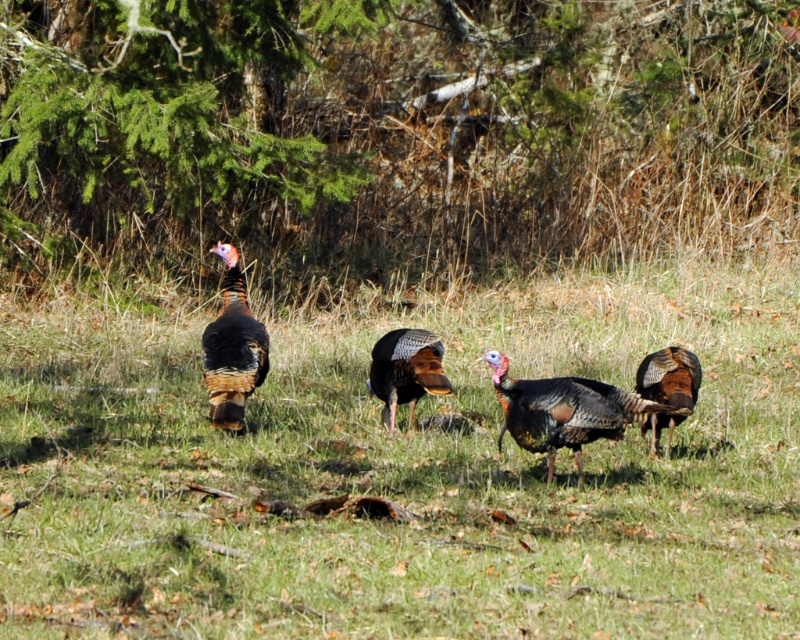
Between glossy iridescent turkey at center and shiny metallic turkey at center, which one has more height?

With more height is glossy iridescent turkey at center.

Is point (574, 401) positioned before point (388, 356)?

Yes, it is.

This screenshot has width=800, height=640. Identify the location of glossy iridescent turkey at center. (554, 412).

Is glossy iridescent turkey at center smaller than multicolored feathered turkey at center?

Incorrect, glossy iridescent turkey at center is not smaller in size than multicolored feathered turkey at center.

Between point (526, 417) and point (214, 380), which one is positioned in front?

Point (526, 417) is in front.

The width and height of the screenshot is (800, 640). In order to click on glossy iridescent turkey at center in this screenshot , I will do pos(554,412).

Describe the element at coordinates (402, 474) in the screenshot. I see `green grass at center` at that location.

From the picture: Who is shorter, green grass at center or multicolored feathered turkey at center?

With less height is green grass at center.

Is point (380, 547) behind point (234, 248)?

No, it is in front of (234, 248).

Identify the location of green grass at center. The image size is (800, 640). (402, 474).